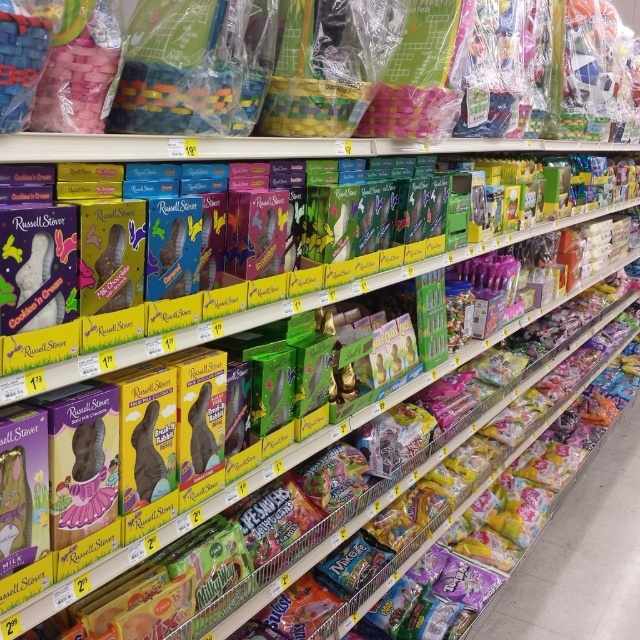
Question: Which point is closer to the camera?

Choices:
 (A) matte plastic easter basket at upper center
 (B) translucent plastic bags at lower right

Answer: (B)

Question: Is translucent plastic bags at lower right positioned in front of matte plastic easter basket at upper center?

Choices:
 (A) no
 (B) yes

Answer: (B)

Question: Considering the relative positions of translucent plastic bags at lower right and matte plastic easter basket at upper center in the image provided, where is translucent plastic bags at lower right located with respect to matte plastic easter basket at upper center?

Choices:
 (A) left
 (B) right

Answer: (B)

Question: Is translucent plastic bags at lower right positioned in front of matte plastic easter basket at upper center?

Choices:
 (A) no
 (B) yes

Answer: (B)